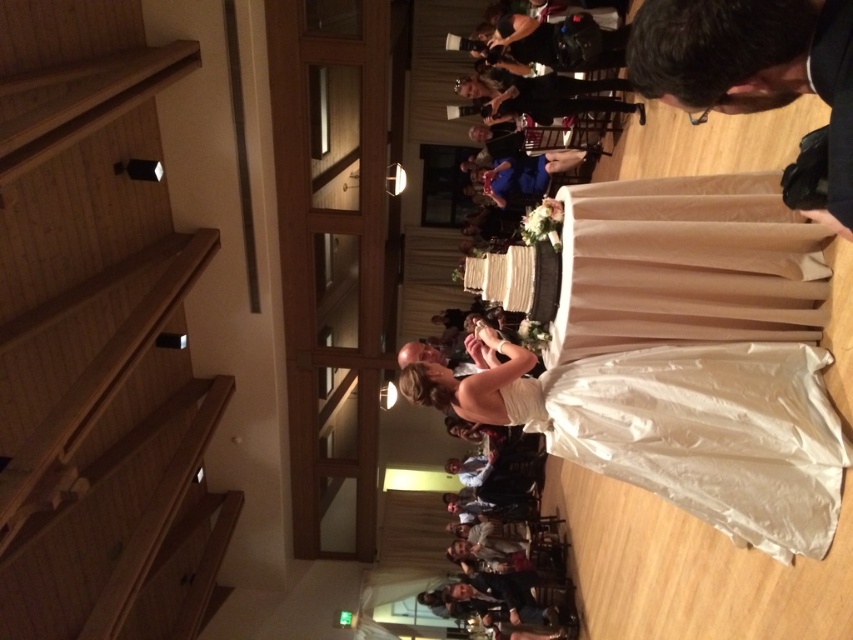
Question: Which object is closer to the camera taking this photo?

Choices:
 (A) white satin dress at center
 (B) light brown wooden stairs at left

Answer: (B)

Question: Can you confirm if white satin dress at center is positioned to the right of black leather camera at upper right?

Choices:
 (A) no
 (B) yes

Answer: (B)

Question: Which object appears closest to the camera in this image?

Choices:
 (A) black leather camera at upper right
 (B) white satin dress at center
 (C) light brown wooden stairs at left

Answer: (A)

Question: Which of these objects is positioned farthest from the light brown wooden stairs at left?

Choices:
 (A) white satin dress at center
 (B) black leather camera at upper right

Answer: (B)

Question: Does light brown wooden stairs at left appear on the right side of white satin dress at center?

Choices:
 (A) yes
 (B) no

Answer: (B)

Question: In this image, where is light brown wooden stairs at left located relative to white satin dress at center?

Choices:
 (A) left
 (B) right

Answer: (A)